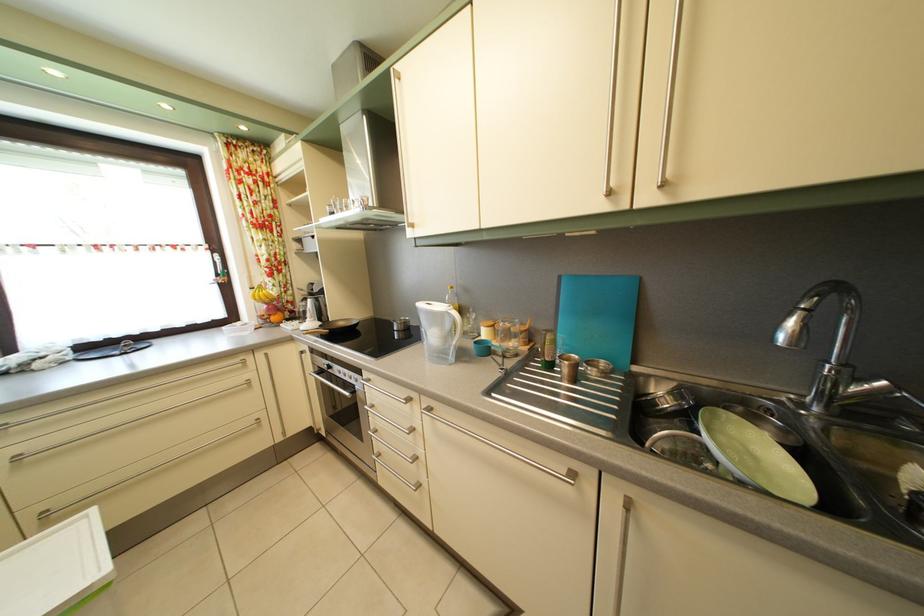
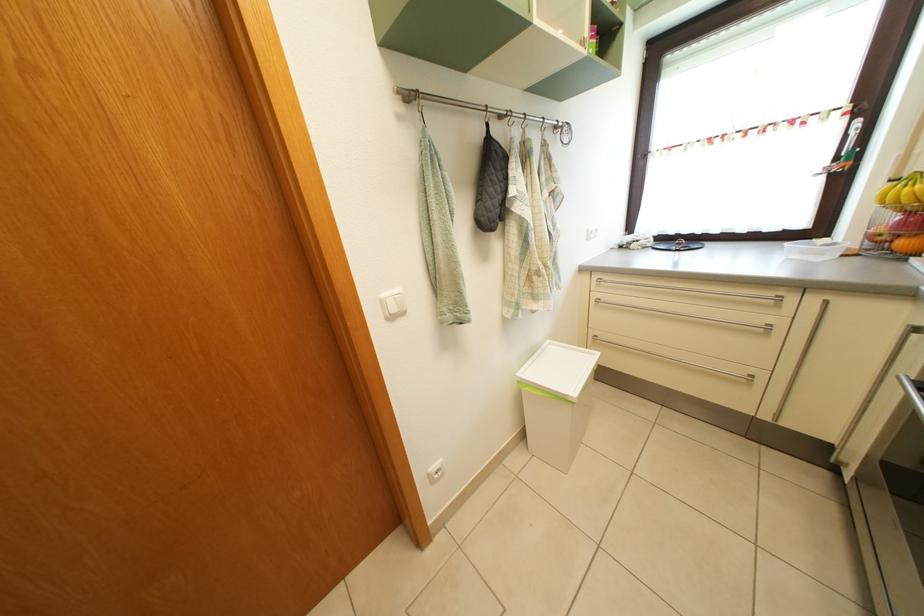
Find the pixel in the second image that matches (x=224, y=270) in the first image.

(853, 146)